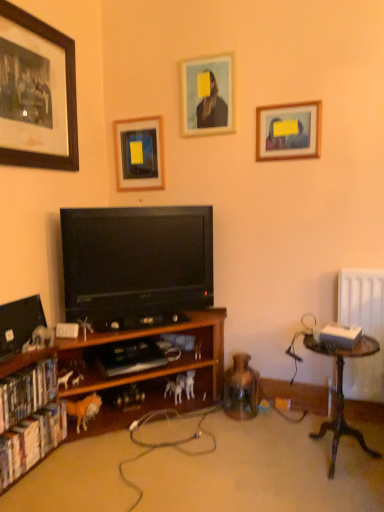
Where is `vacant space to the right of wooden bookshelf at left`? This screenshot has width=384, height=512. vacant space to the right of wooden bookshelf at left is located at coordinates (259, 460).